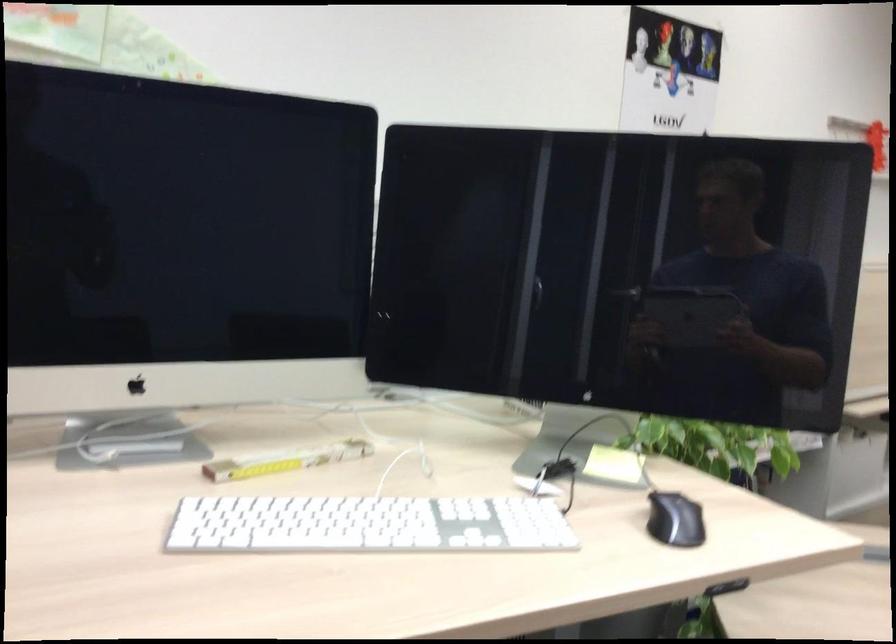
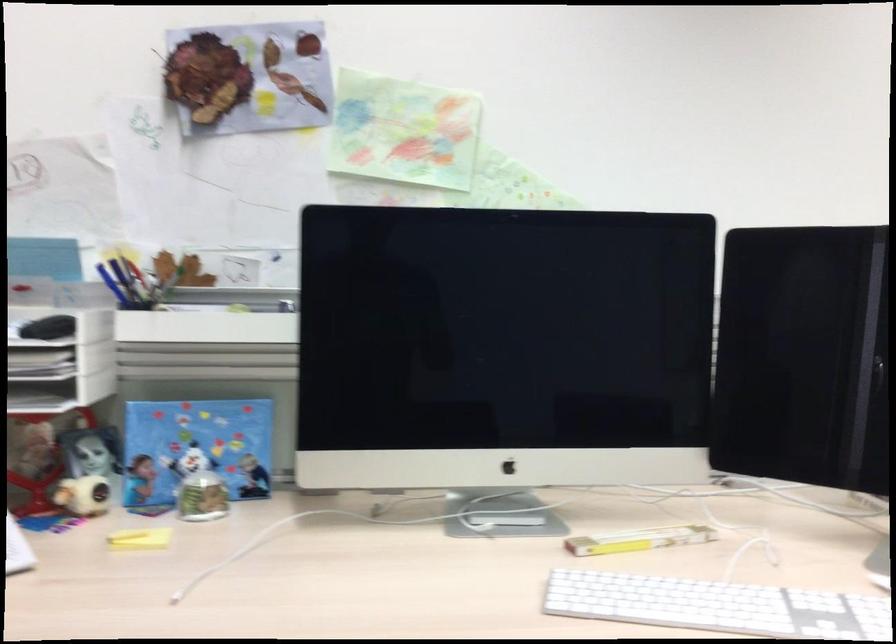
Locate, in the second image, the point that corresponds to the point at 286,460 in the first image.

(638, 540)